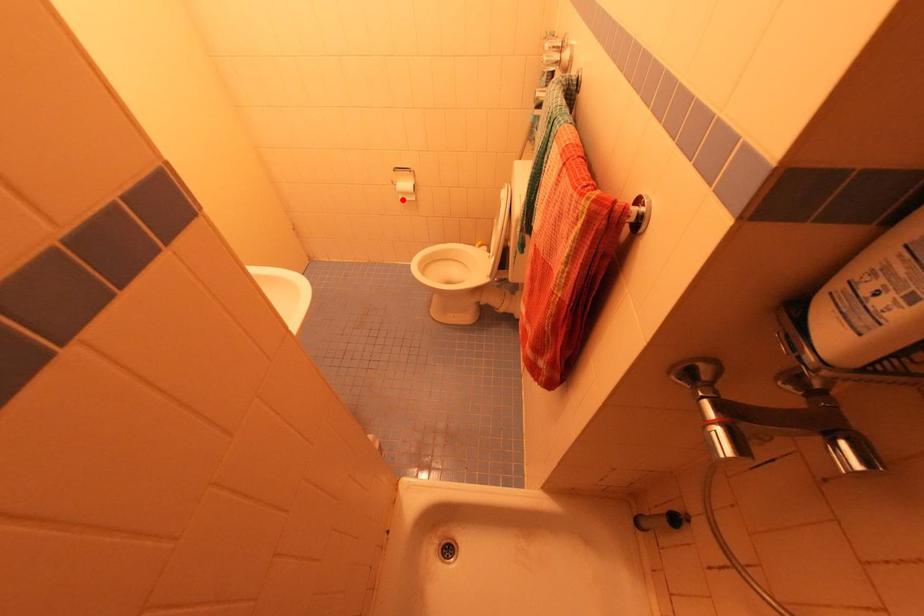
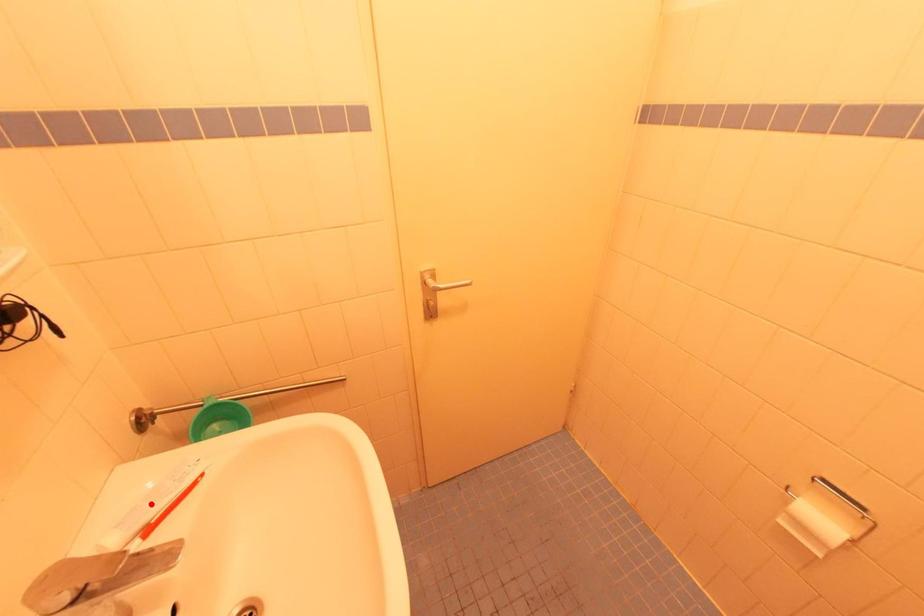
I am providing you with two images of the same scene from different viewpoints. A red point is marked on the first image and another point is marked on the second image. Is the marked point in image1 the same physical position as the marked point in image2?

No